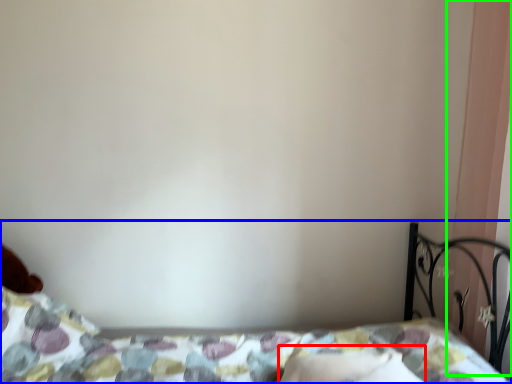
Question: Which object is positioned farthest from pillow (highlighted by a red box)? Select from bed (highlighted by a blue box) and curtain (highlighted by a green box).

Choices:
 (A) bed
 (B) curtain

Answer: (B)